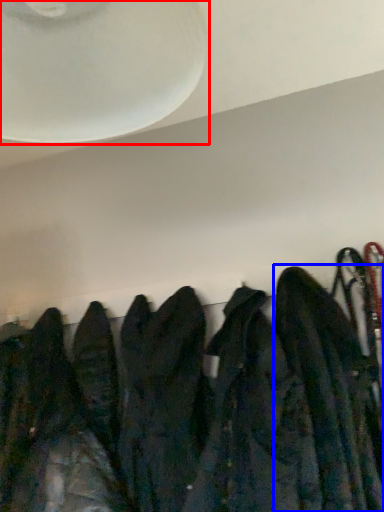
Question: Which object is further to the camera taking this photo, fan (highlighted by a red box) or jacket (highlighted by a blue box)?

Choices:
 (A) fan
 (B) jacket

Answer: (B)